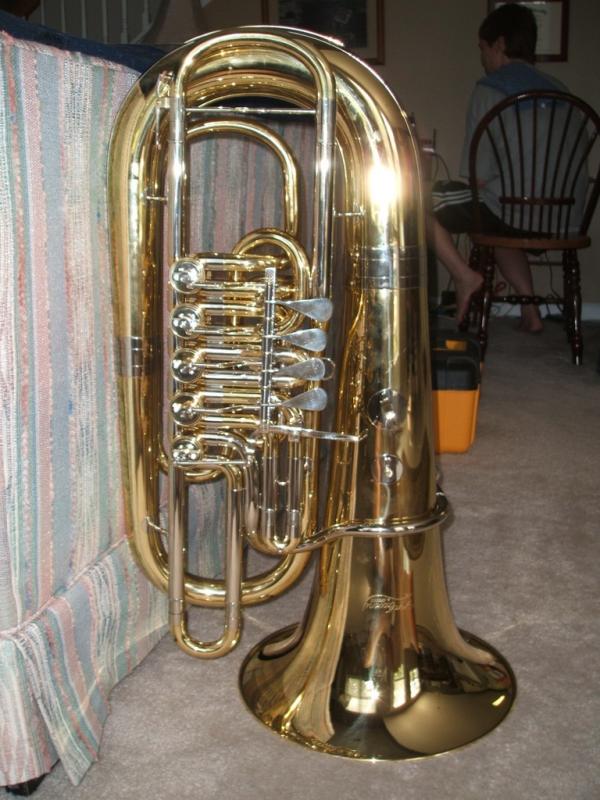
The height and width of the screenshot is (800, 600). I want to click on chair, so click(x=536, y=242).